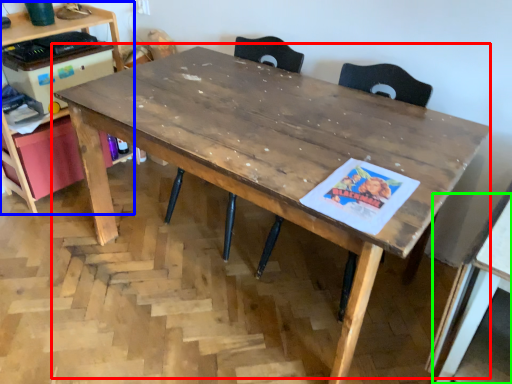
Question: Estimate the real-world distances between objects in this image. Which object is farther from table (highlighted by a red box), computer desk (highlighted by a blue box) or table (highlighted by a green box)?

Choices:
 (A) computer desk
 (B) table

Answer: (A)